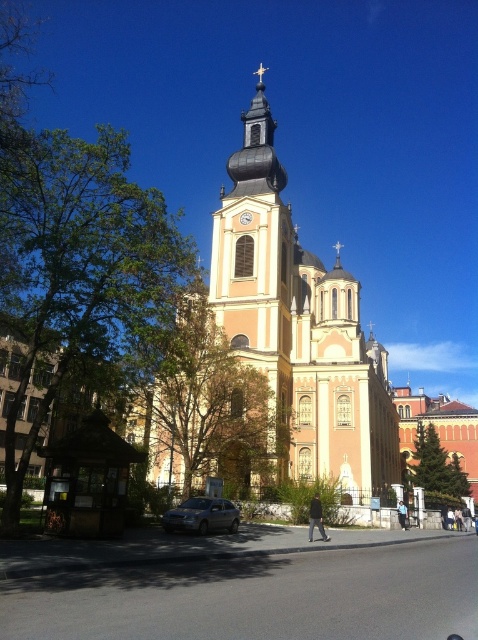
You are a photographer planning to take a wide shot of the pink stone church at center and the satin silver sedan at lower center. Which object should you focus on first to ensure it appears larger in the photo?

The pink stone church at center should be focused on first because it has a larger size compared to the satin silver sedan at lower center, ensuring it will appear bigger in the photo.

You are a delivery person who needs to park your vehicle near the church. The parking spot you want is at coordinates point 0.808, 0.423. Is the satin silver sedan at lower center blocking your desired parking spot?

The satin silver sedan at lower center is located at point [202,513], so yes, it is blocking your desired parking spot at coordinates point [202,516] because the sedan is already occupying that area.